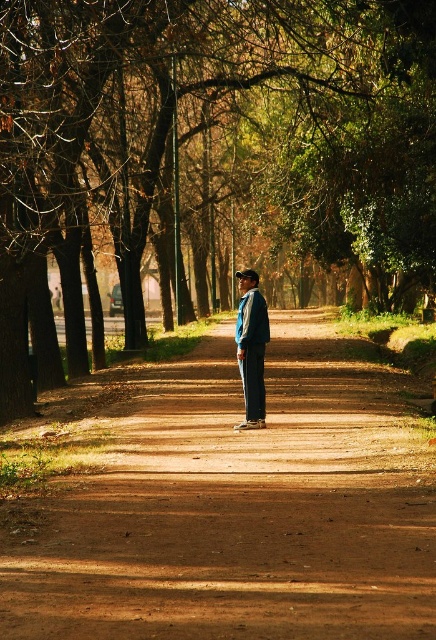
Measure the distance between dirt road at center and camera.

dirt road at center and camera are 20.32 feet apart from each other.

Locate an element on the screen. The width and height of the screenshot is (436, 640). dirt road at center is located at coordinates (241, 508).

Find the location of a particular element. This screenshot has width=436, height=640. dirt road at center is located at coordinates pyautogui.click(x=241, y=508).

Who is lower down, brown bark tree at center or denim jacket at center?

denim jacket at center

Between brown bark tree at center and denim jacket at center, which one appears on the right side from the viewer's perspective?

Positioned to the right is brown bark tree at center.

Locate an element on the screen. The height and width of the screenshot is (640, 436). brown bark tree at center is located at coordinates (218, 140).

Locate an element on the screen. brown bark tree at center is located at coordinates (x=218, y=140).

Does brown bark tree at center lie in front of dirt road at center?

No, it is behind dirt road at center.

Based on the photo, between brown bark tree at center and dirt road at center, which one has more height?

brown bark tree at center is taller.

Where is `brown bark tree at center`? Image resolution: width=436 pixels, height=640 pixels. brown bark tree at center is located at coordinates (218, 140).

Where is `brown bark tree at center`? brown bark tree at center is located at coordinates (218, 140).